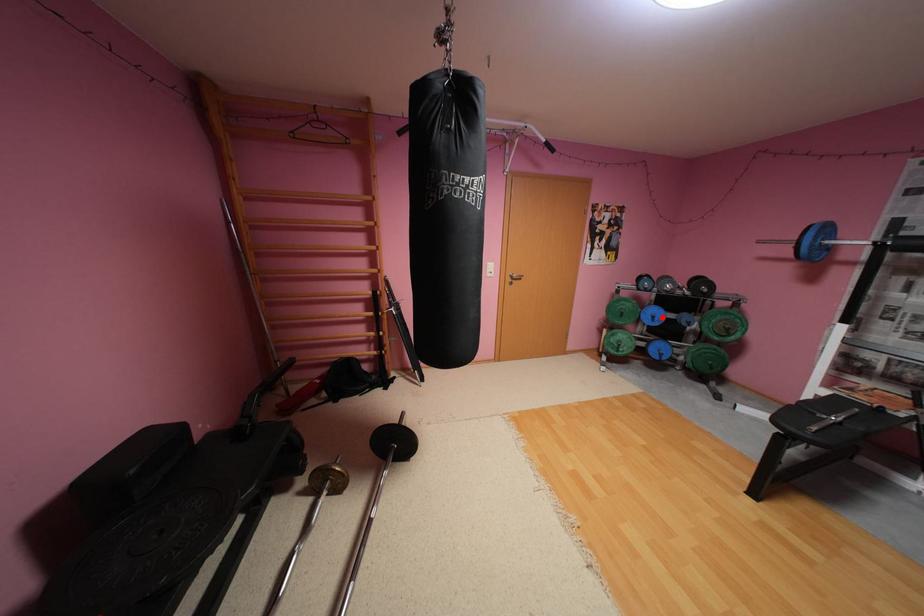
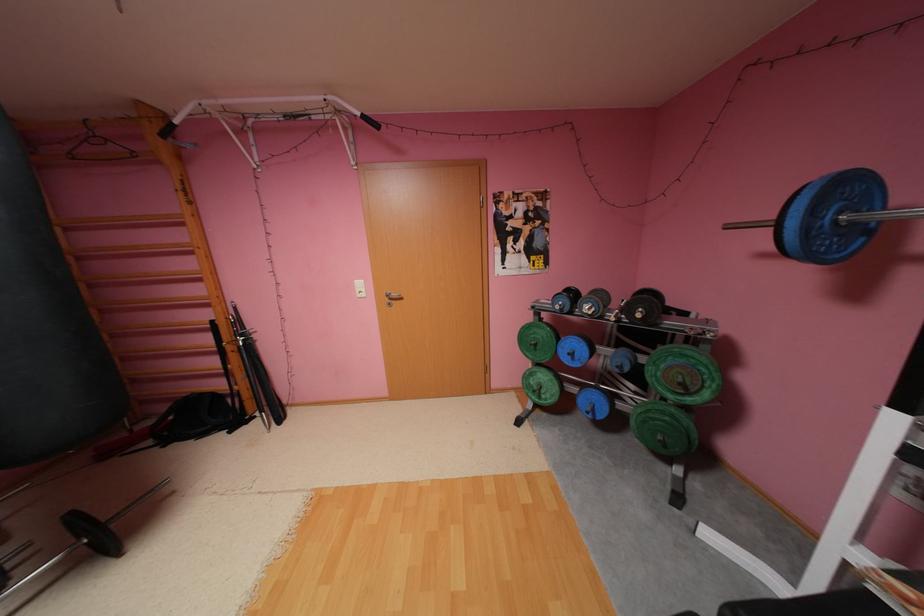
In the second image, find the point that corresponds to the highlighted location in the first image.

(580, 354)